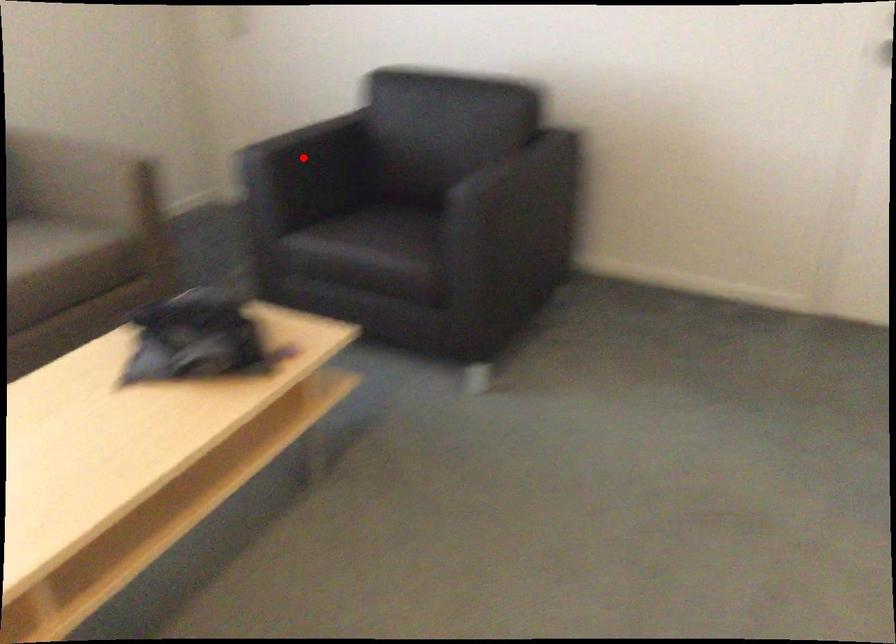
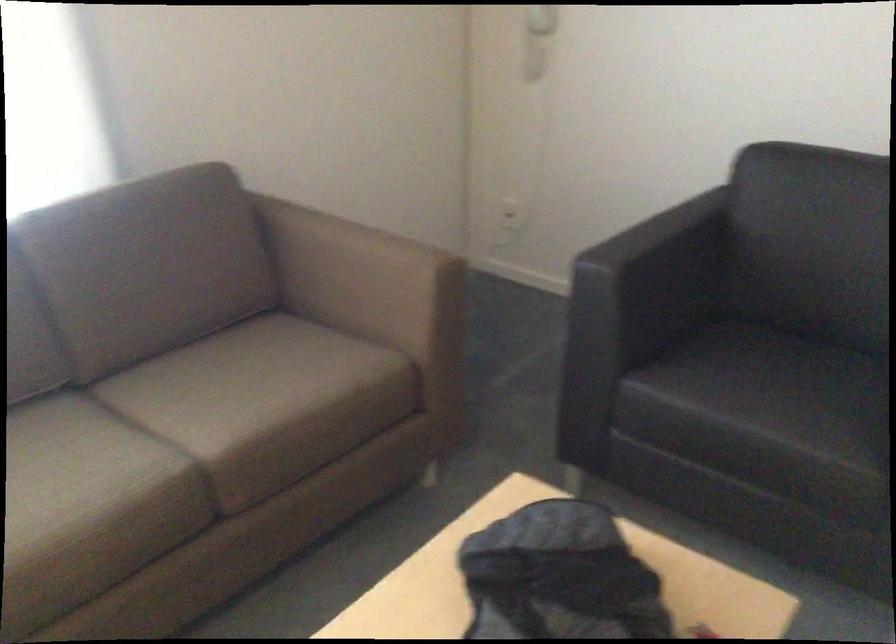
Find the pixel in the second image that matches the highlighted location in the first image.

(652, 270)